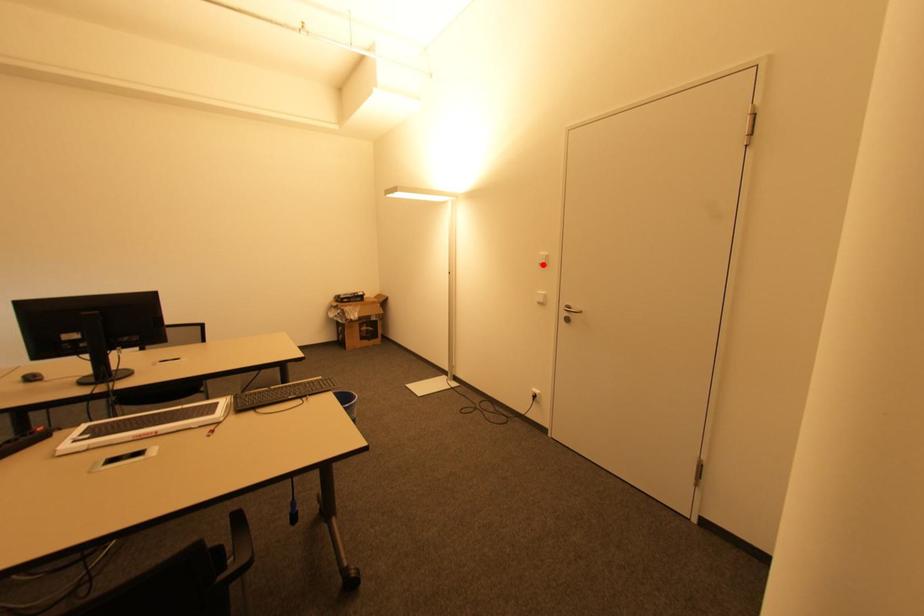
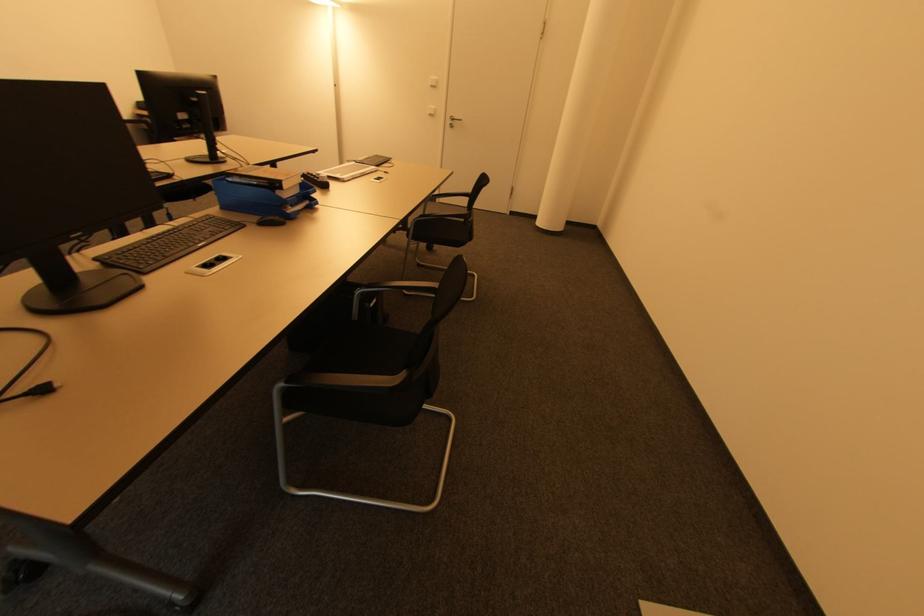
Question: I am providing you with two images of the same scene from different viewpoints. A red point is marked on the first image. At the location where the point appears in image 1, is it still visible in image 2?

Choices:
 (A) Yes
 (B) No

Answer: (A)